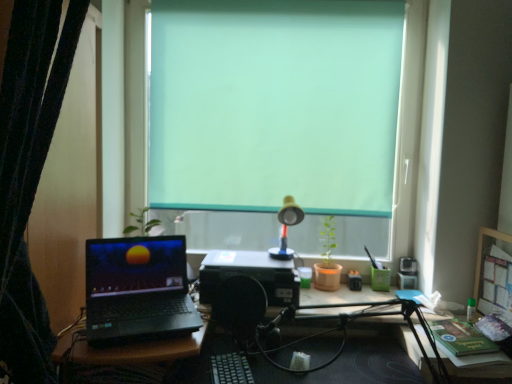
Question: Should I look upward or downward to see teal matte window at center?

Choices:
 (A) up
 (B) down

Answer: (A)

Question: Does black fabric curtain at left have a greater height compared to teal matte window at center?

Choices:
 (A) no
 (B) yes

Answer: (B)

Question: From the image's perspective, would you say black fabric curtain at left is shown under teal matte window at center?

Choices:
 (A) no
 (B) yes

Answer: (B)

Question: Is the position of black fabric curtain at left less distant than that of teal matte window at center?

Choices:
 (A) yes
 (B) no

Answer: (A)

Question: Would you say black fabric curtain at left is a long distance from teal matte window at center?

Choices:
 (A) yes
 (B) no

Answer: (A)

Question: Does black fabric curtain at left have a lesser height compared to teal matte window at center?

Choices:
 (A) no
 (B) yes

Answer: (A)

Question: Is black fabric curtain at left not inside teal matte window at center?

Choices:
 (A) no
 (B) yes

Answer: (B)

Question: Is teal matte window at center not near black fabric curtain at left?

Choices:
 (A) yes
 (B) no

Answer: (A)

Question: Can you confirm if teal matte window at center is wider than black fabric curtain at left?

Choices:
 (A) yes
 (B) no

Answer: (B)

Question: Can you confirm if teal matte window at center is shorter than black fabric curtain at left?

Choices:
 (A) no
 (B) yes

Answer: (B)

Question: Is teal matte window at center oriented away from black fabric curtain at left?

Choices:
 (A) yes
 (B) no

Answer: (B)

Question: From a real-world perspective, is teal matte window at center over black fabric curtain at left?

Choices:
 (A) no
 (B) yes

Answer: (B)

Question: Is teal matte window at center completely or partially outside of black fabric curtain at left?

Choices:
 (A) no
 (B) yes

Answer: (B)

Question: From a real-world perspective, is teal matte window at center above or below black fabric curtain at left?

Choices:
 (A) below
 (B) above

Answer: (B)